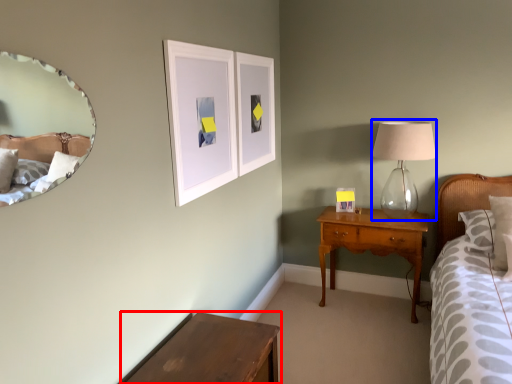
Question: Which point is further to the camera, table (highlighted by a red box) or table lamp (highlighted by a blue box)?

Choices:
 (A) table
 (B) table lamp

Answer: (B)